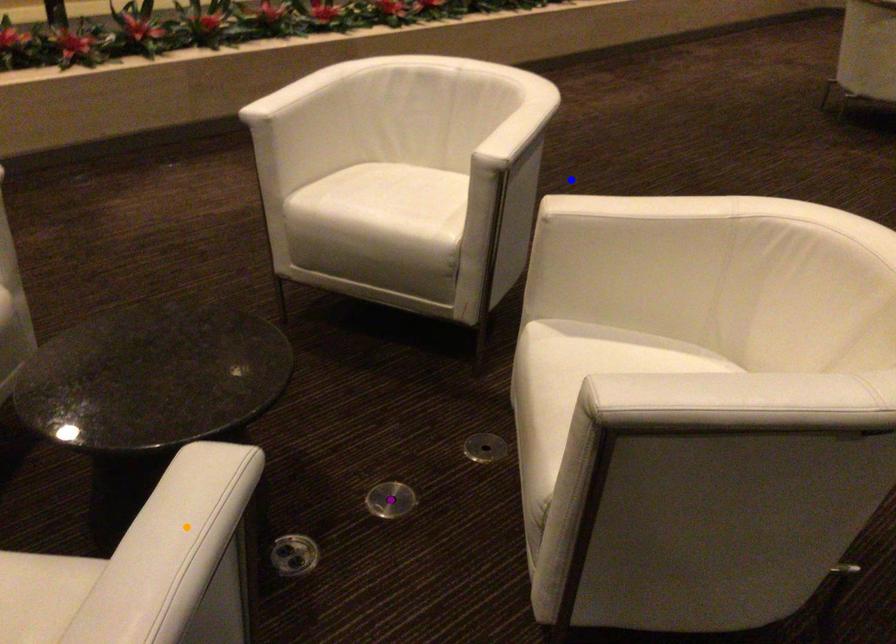
Order these from farthest to nearest:
orange point
blue point
purple point

1. blue point
2. purple point
3. orange point